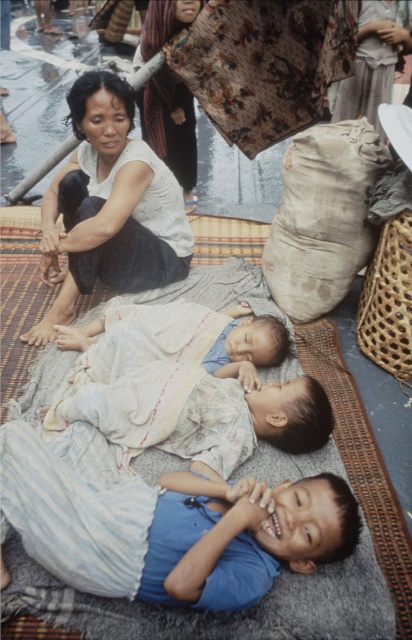
Question: Can you confirm if white cotton shirt at upper left is wider than beige fabric sack at center?

Choices:
 (A) yes
 (B) no

Answer: (A)

Question: Which point is closer to the camera?

Choices:
 (A) blue cotton shirt at lower center
 (B) beige fabric sack at center

Answer: (A)

Question: Does blue cotton shirt at lower center have a greater width compared to light blue fabric at center?

Choices:
 (A) no
 (B) yes

Answer: (B)

Question: Which point is closer to the camera?

Choices:
 (A) (175, 241)
 (B) (11, 440)
 (C) (147, 102)

Answer: (B)

Question: Which of the following is the farthest from the observer?

Choices:
 (A) (322, 150)
 (B) (142, 424)
 (C) (383, 547)

Answer: (A)

Question: Is beige fabric sack at center closer to the viewer compared to light blue fabric at center?

Choices:
 (A) no
 (B) yes

Answer: (A)